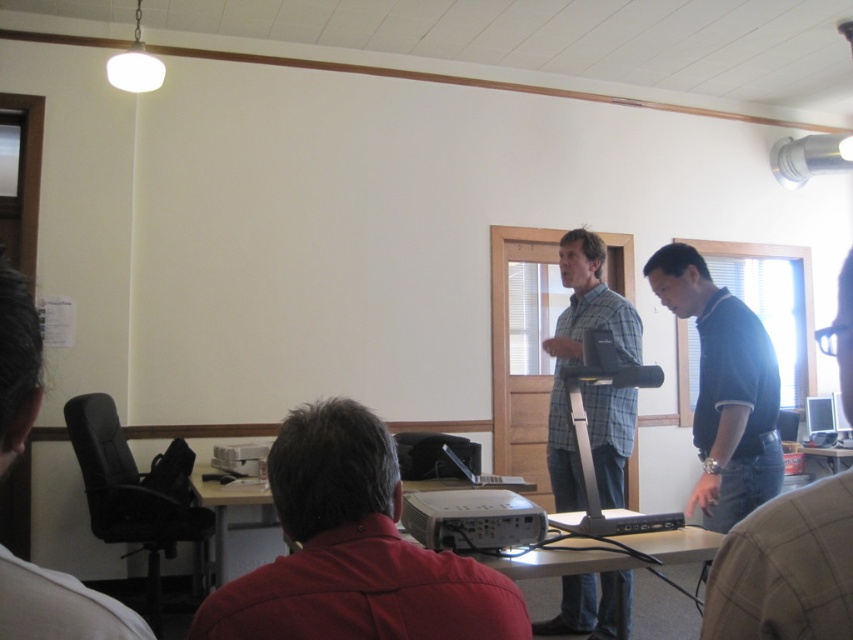
Between blue smooth shirt at right and white plastic projector at center, which one appears on the left side from the viewer's perspective?

From the viewer's perspective, white plastic projector at center appears more on the left side.

Which of these two, blue smooth shirt at right or white plastic projector at center, stands taller?

With more height is blue smooth shirt at right.

The width and height of the screenshot is (853, 640). I want to click on blue smooth shirt at right, so click(x=724, y=388).

At what (x,y) coordinates should I click in order to perform the action: click on blue smooth shirt at right. Please return your answer as a coordinate pair (x, y). Looking at the image, I should click on (724, 388).

Who is higher up, blue polo shirt at right or silver metallic monitor at center?

blue polo shirt at right

Between blue polo shirt at right and silver metallic monitor at center, which one has less height?

Standing shorter between the two is silver metallic monitor at center.

From the picture: Who is more distant from viewer, (817, 500) or (817, 424)?

Point (817, 424)

This screenshot has height=640, width=853. I want to click on blue polo shirt at right, so click(786, 568).

Is red matte projector at lower center smaller than silver metallic monitor at center?

No, red matte projector at lower center is not smaller than silver metallic monitor at center.

Does point (490, 612) lie in front of point (822, 410)?

Yes, it is.

The image size is (853, 640). Describe the element at coordinates (352, 550) in the screenshot. I see `red matte projector at lower center` at that location.

Where is `red matte projector at lower center`? red matte projector at lower center is located at coordinates (352, 550).